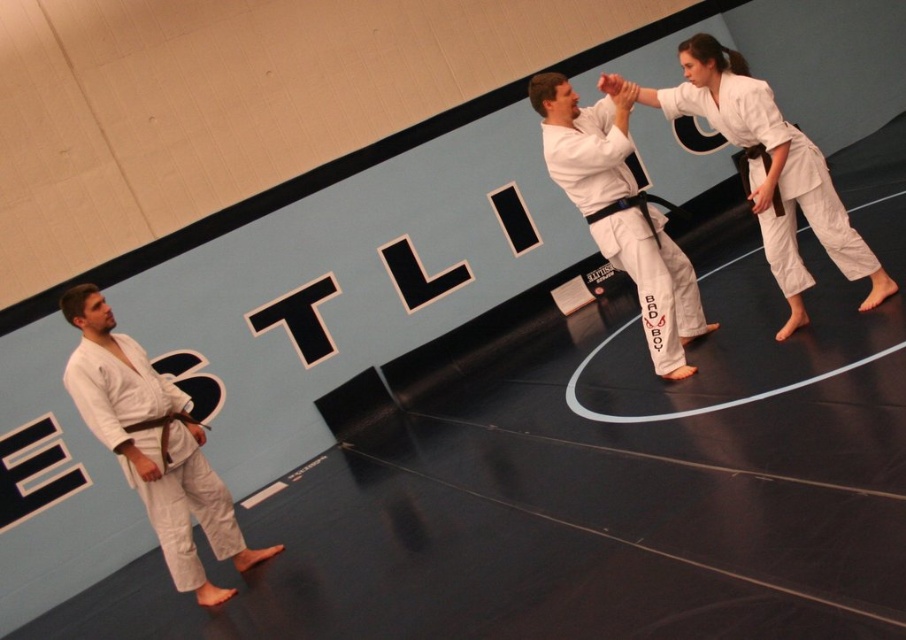
Question: Does white matte karate gi at center have a smaller size compared to black leather belt at center?

Choices:
 (A) yes
 (B) no

Answer: (B)

Question: Which object is positioned farthest from the black leather belt at center?

Choices:
 (A) white karate uniform at center
 (B) white matte kimono at left
 (C) white matte karate gi at center

Answer: (B)

Question: Can you confirm if white matte karate gi at center is bigger than black leather belt at center?

Choices:
 (A) yes
 (B) no

Answer: (A)

Question: Which object is the closest to the white matte kimono at left?

Choices:
 (A) white matte karate gi at center
 (B) black leather belt at center
 (C) white karate uniform at center

Answer: (C)

Question: Which point is farther to the camera?

Choices:
 (A) (614, 93)
 (B) (93, 333)

Answer: (A)

Question: Is white matte kimono at left above black leather belt at center?

Choices:
 (A) yes
 (B) no

Answer: (B)